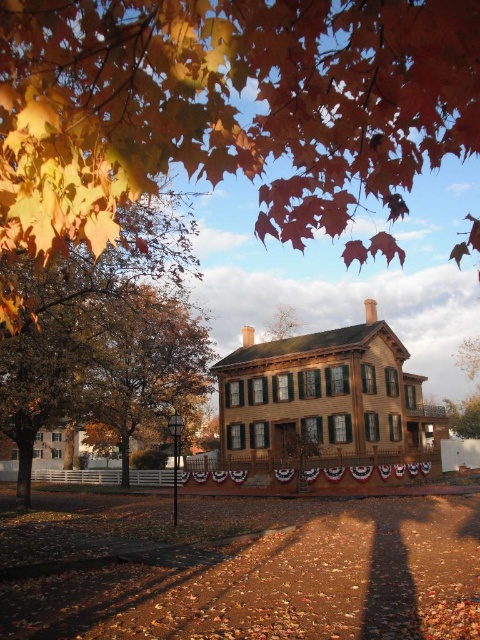
Question: Is golden matte leaf at upper left positioned in front of golden leafy tree at upper left?

Choices:
 (A) yes
 (B) no

Answer: (A)

Question: Which of the following is the farthest from the observer?

Choices:
 (A) golden leafy tree at upper left
 (B) golden matte leaf at upper left

Answer: (A)

Question: Considering the relative positions of golden leafy tree at upper left and brown wooden house at center in the image provided, where is golden leafy tree at upper left located with respect to brown wooden house at center?

Choices:
 (A) below
 (B) above

Answer: (B)

Question: Does golden matte leaf at upper left come behind golden leafy tree at upper left?

Choices:
 (A) no
 (B) yes

Answer: (A)

Question: Which point is closer to the camera?

Choices:
 (A) (450, 42)
 (B) (381, 456)
 (C) (160, 406)

Answer: (A)

Question: Which object is farther from the camera taking this photo?

Choices:
 (A) golden leafy tree at upper left
 (B) brown wooden house at center
 (C) golden matte leaf at upper left

Answer: (B)